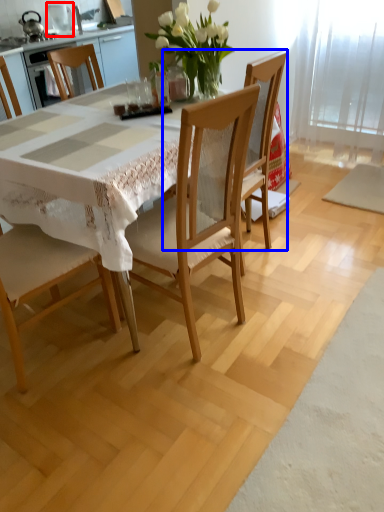
Question: Which object appears closest to the camera in this image, appliance (highlighted by a red box) or chair (highlighted by a blue box)?

Choices:
 (A) appliance
 (B) chair

Answer: (B)